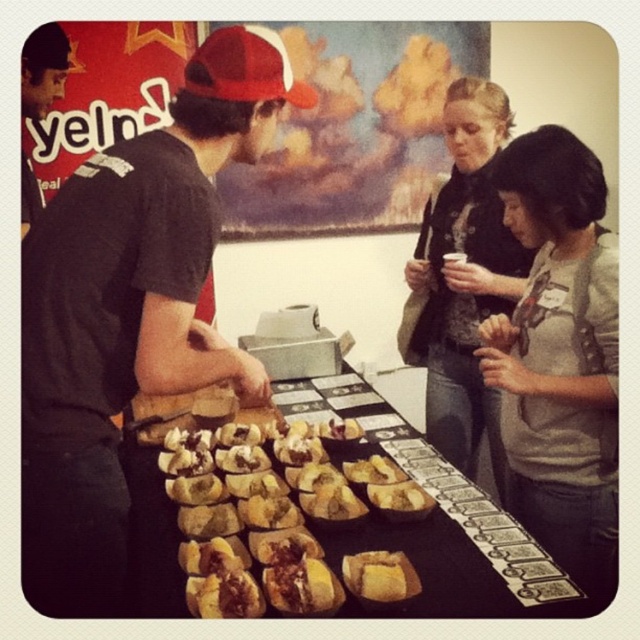
Question: Estimate the real-world distances between objects in this image. Which object is closer to the golden brown bread at center?

Choices:
 (A) matte black shirt at center
 (B) brown crumbly bread at center

Answer: (B)

Question: Is gray cotton shirt at center to the right of matte black shirt at left from the viewer's perspective?

Choices:
 (A) yes
 (B) no

Answer: (A)

Question: Which point is closer to the camera?

Choices:
 (A) golden crispy bread at center
 (B) golden brown bread at center
 (C) matte black shirt at left

Answer: (A)

Question: Does matte black shirt at center come behind golden-brown bread rolls at center?

Choices:
 (A) no
 (B) yes

Answer: (A)

Question: Which object is farther from the camera taking this photo?

Choices:
 (A) golden brown bread at center
 (B) golden crispy bread at center

Answer: (A)

Question: Is golden-brown bread rolls at center positioned at the back of dark gray sweater at center?

Choices:
 (A) no
 (B) yes

Answer: (A)